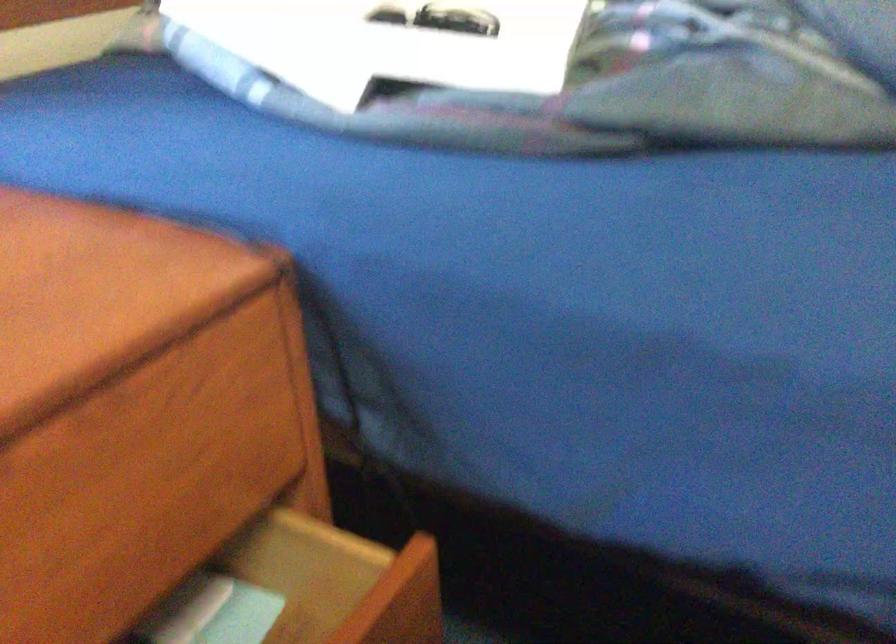
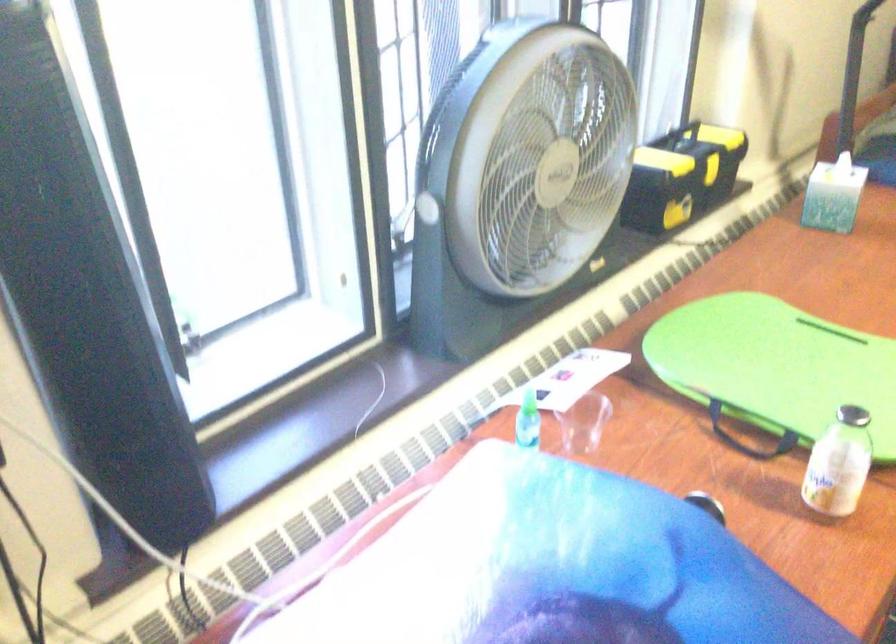
In a continuous first-person perspective shot, in which direction is the camera moving?

The cameraman walked toward left, backward.